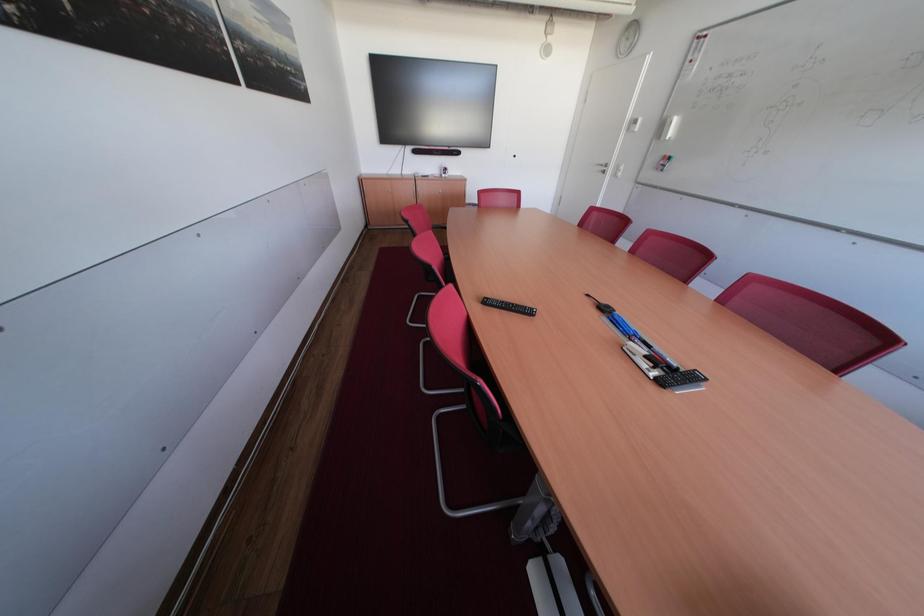
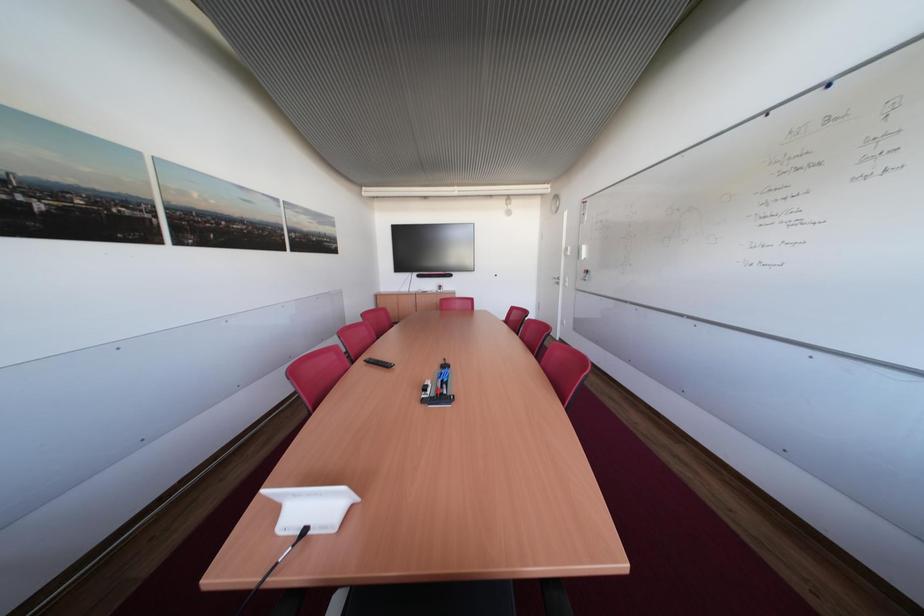
In the scene shown: What movement of the cameraman would produce the second image?

The cameraman walked toward right, backward.